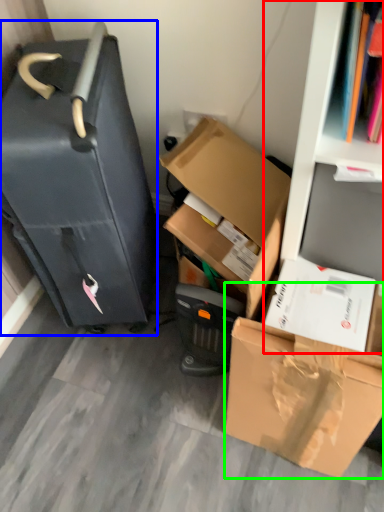
Question: Which object is the farthest from bookshelf (highlighted by a red box)? Choose among these: suitcase (highlighted by a blue box) or box (highlighted by a green box).

Choices:
 (A) suitcase
 (B) box

Answer: (A)